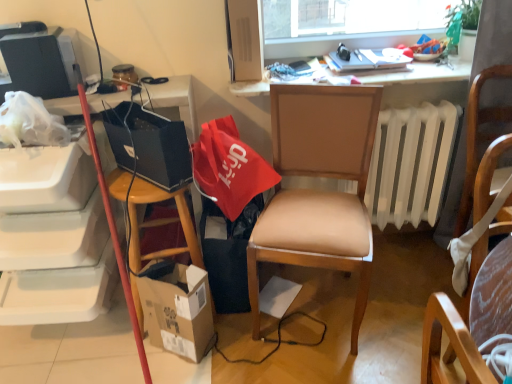
Image resolution: width=512 pixels, height=384 pixels. Identify the location of empty space that is ontop of matte black laptop at upper center (from a real-world perspective). (372, 56).